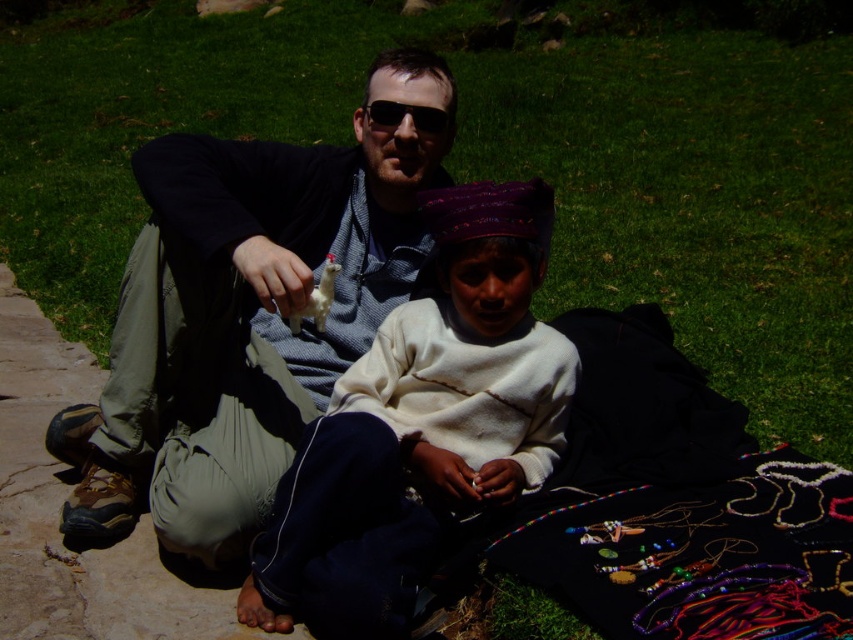
Is green grass at center in front of white soft sweater at center?

No, green grass at center is further to the viewer.

Is point (267, 33) more distant than point (343, 477)?

Yes, point (267, 33) is farther from viewer.

Identify the location of green grass at center. The height and width of the screenshot is (640, 853). (693, 200).

Which of these two, green grass at center or black plastic sunglasses at center, stands shorter?

With less height is black plastic sunglasses at center.

Which is in front, point (195, 38) or point (440, 122)?

Point (440, 122) is in front.

Image resolution: width=853 pixels, height=640 pixels. What are the coordinates of `green grass at center` in the screenshot? It's located at (693, 200).

Is point (196, 381) farther from viewer compared to point (432, 113)?

Yes, point (196, 381) is behind point (432, 113).

Between matte gray sweater at center and black plastic sunglasses at center, which one is positioned lower?

matte gray sweater at center is lower down.

Image resolution: width=853 pixels, height=640 pixels. What do you see at coordinates (247, 316) in the screenshot?
I see `matte gray sweater at center` at bounding box center [247, 316].

Locate an element on the screen. Image resolution: width=853 pixels, height=640 pixels. matte gray sweater at center is located at coordinates (247, 316).